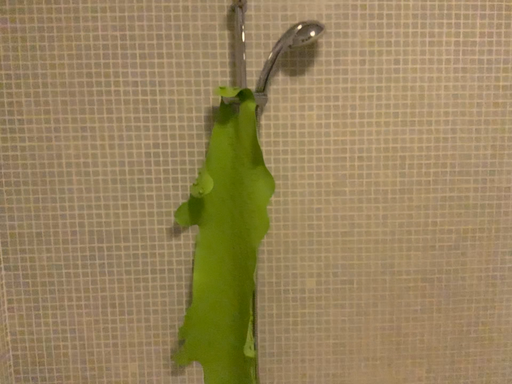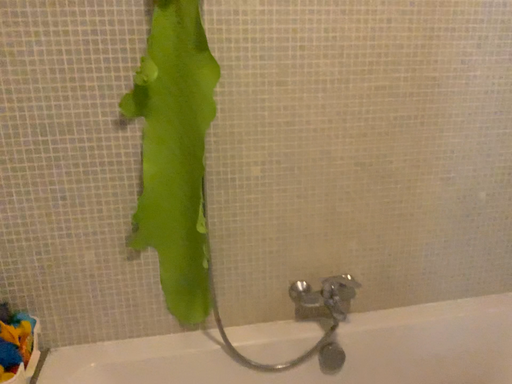
Question: How did the camera likely rotate when shooting the video?

Choices:
 (A) rotated downward
 (B) rotated upward

Answer: (A)